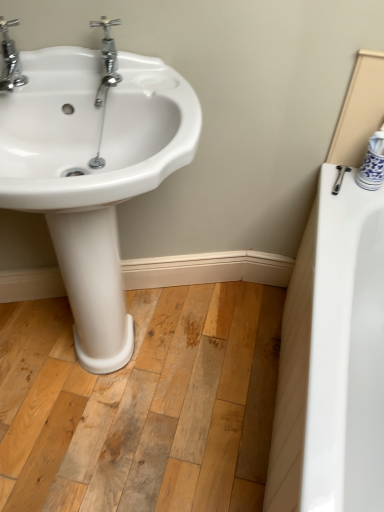
Question: Does chrome/metallic faucet at upper left, arranged as the first tap when viewed from the right, have a lesser width compared to white glossy sink at left?

Choices:
 (A) yes
 (B) no

Answer: (A)

Question: From a real-world perspective, is chrome/metallic faucet at upper left, arranged as the first tap when viewed from the right, positioned under white glossy sink at left based on gravity?

Choices:
 (A) yes
 (B) no

Answer: (B)

Question: Is chrome/metallic faucet at upper left, arranged as the first tap when viewed from the right, bigger than white glossy sink at left?

Choices:
 (A) no
 (B) yes

Answer: (A)

Question: Can you confirm if chrome/metallic faucet at upper left, the 2th tap in the left-to-right sequence, is smaller than white glossy sink at left?

Choices:
 (A) no
 (B) yes

Answer: (B)

Question: From the image's perspective, is chrome/metallic faucet at upper left, the 2th tap in the left-to-right sequence, beneath white glossy sink at left?

Choices:
 (A) yes
 (B) no

Answer: (B)

Question: From their relative heights in the image, would you say white glossy sink at left is taller or shorter than chrome metallic faucet at upper left, the 1th tap from the left?

Choices:
 (A) tall
 (B) short

Answer: (A)

Question: Considering the positions of white glossy sink at left and chrome metallic faucet at upper left, the 1th tap from the left, in the image, is white glossy sink at left bigger or smaller than chrome metallic faucet at upper left, the 1th tap from the left,?

Choices:
 (A) small
 (B) big

Answer: (B)

Question: From the image's perspective, is white glossy sink at left positioned above or below chrome metallic faucet at upper left, the 1th tap from the left?

Choices:
 (A) above
 (B) below

Answer: (B)

Question: Is white glossy sink at left to the left or to the right of chrome metallic faucet at upper left, the second tap when ordered from right to left, in the image?

Choices:
 (A) left
 (B) right

Answer: (B)

Question: From their relative heights in the image, would you say chrome metallic faucet at upper left, the 1th tap from the left, is taller or shorter than white glossy sink at left?

Choices:
 (A) short
 (B) tall

Answer: (A)

Question: Considering the positions of chrome metallic faucet at upper left, the 1th tap from the left, and white glossy sink at left in the image, is chrome metallic faucet at upper left, the 1th tap from the left, wider or thinner than white glossy sink at left?

Choices:
 (A) wide
 (B) thin

Answer: (B)

Question: Does point (13, 66) appear closer or farther from the camera than point (173, 167)?

Choices:
 (A) closer
 (B) farther

Answer: (B)

Question: From a real-world perspective, is chrome metallic faucet at upper left, the second tap when ordered from right to left, physically located above or below white glossy sink at left?

Choices:
 (A) above
 (B) below

Answer: (A)

Question: Looking at their shapes, would you say white glossy sink at left is wider or thinner than chrome/metallic faucet at upper left, the 2th tap in the left-to-right sequence?

Choices:
 (A) wide
 (B) thin

Answer: (A)

Question: Does point (74, 274) appear closer or farther from the camera than point (99, 96)?

Choices:
 (A) farther
 (B) closer

Answer: (A)